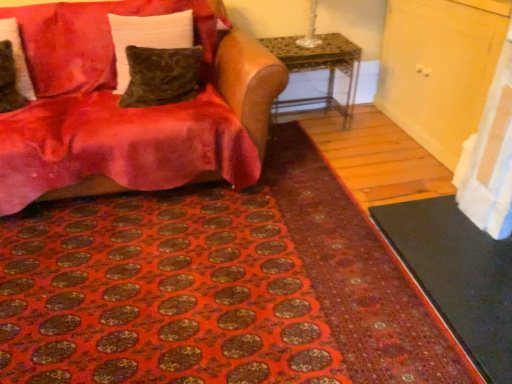
Identify the location of free space to the back side of black rubber doormat at lower right. The image size is (512, 384). [x=374, y=175].